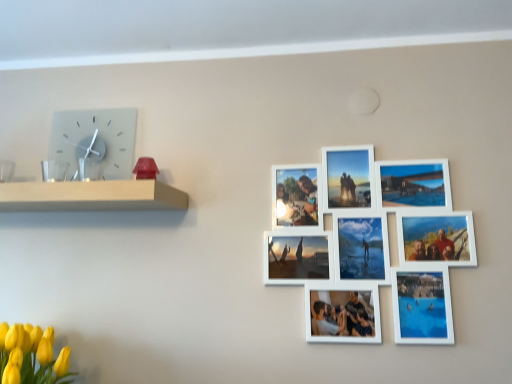
Question: Is matte glass clock at upper left completely or partially outside of white wooden shelf at left?

Choices:
 (A) yes
 (B) no

Answer: (A)

Question: From the image's perspective, is matte glass clock at upper left located above white wooden shelf at left?

Choices:
 (A) yes
 (B) no

Answer: (A)

Question: Is white wooden shelf at left inside matte glass clock at upper left?

Choices:
 (A) no
 (B) yes

Answer: (A)

Question: From a real-world perspective, is matte glass clock at upper left under white wooden shelf at left?

Choices:
 (A) no
 (B) yes

Answer: (A)

Question: From the image's perspective, is matte glass clock at upper left under white wooden shelf at left?

Choices:
 (A) yes
 (B) no

Answer: (B)

Question: Does matte glass clock at upper left appear on the right side of white wooden shelf at left?

Choices:
 (A) no
 (B) yes

Answer: (A)

Question: Considering the relative sizes of white wooden shelf at left and matte glass clock at upper left in the image provided, is white wooden shelf at left taller than matte glass clock at upper left?

Choices:
 (A) no
 (B) yes

Answer: (A)

Question: Does white wooden shelf at left have a lesser height compared to matte glass clock at upper left?

Choices:
 (A) yes
 (B) no

Answer: (A)

Question: Is the position of white wooden shelf at left less distant than that of matte glass clock at upper left?

Choices:
 (A) yes
 (B) no

Answer: (A)

Question: Is white wooden shelf at left oriented towards matte glass clock at upper left?

Choices:
 (A) no
 (B) yes

Answer: (A)

Question: Considering the relative sizes of white wooden shelf at left and matte glass clock at upper left in the image provided, is white wooden shelf at left thinner than matte glass clock at upper left?

Choices:
 (A) yes
 (B) no

Answer: (B)

Question: Is white wooden shelf at left facing away from matte glass clock at upper left?

Choices:
 (A) yes
 (B) no

Answer: (B)

Question: Considering the relative sizes of yellow matte tulips at lower left and white matte picture frame at upper right in the image provided, is yellow matte tulips at lower left thinner than white matte picture frame at upper right?

Choices:
 (A) no
 (B) yes

Answer: (A)